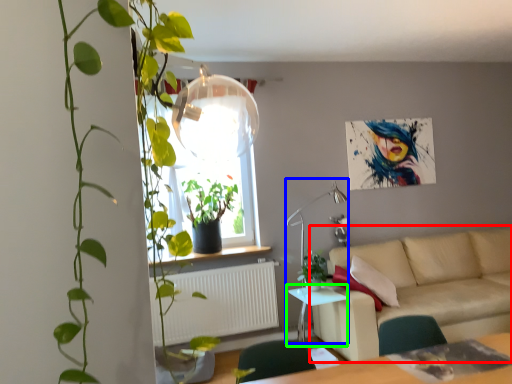
Question: Which object is positioned farthest from studio couch (highlighted by a red box)? Select from lamp (highlighted by a blue box) and table (highlighted by a green box).

Choices:
 (A) lamp
 (B) table

Answer: (A)